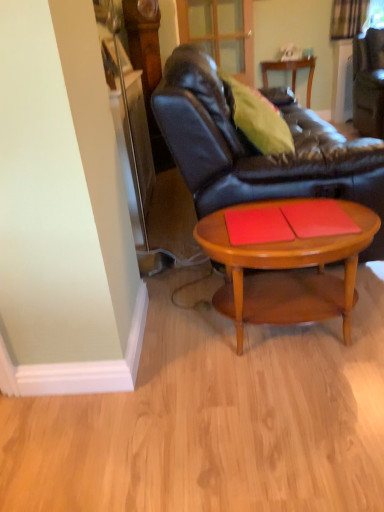
Question: Is red matte placemat at center, the second plank viewed from the left, positioned beyond the bounds of leather couch at center?

Choices:
 (A) yes
 (B) no

Answer: (A)

Question: Is red matte placemat at center, the first plank from the right, wider than leather couch at center?

Choices:
 (A) no
 (B) yes

Answer: (A)

Question: Is red matte placemat at center, the second plank viewed from the left, turned away from leather couch at center?

Choices:
 (A) yes
 (B) no

Answer: (A)

Question: Is red matte placemat at center, the second plank viewed from the left, surrounding leather couch at center?

Choices:
 (A) yes
 (B) no

Answer: (B)

Question: From the image's perspective, does red matte placemat at center, the second plank viewed from the left, appear higher than leather couch at center?

Choices:
 (A) yes
 (B) no

Answer: (B)

Question: Looking at their shapes, would you say light brown wood coffee table at center is wider or thinner than red matte book at center, which ranks as the 2th plank in right-to-left order?

Choices:
 (A) thin
 (B) wide

Answer: (B)

Question: Considering the positions of light brown wood coffee table at center and red matte book at center, the first plank when ordered from left to right, in the image, is light brown wood coffee table at center taller or shorter than red matte book at center, the first plank when ordered from left to right,?

Choices:
 (A) tall
 (B) short

Answer: (A)

Question: Is light brown wood coffee table at center spatially inside red matte book at center, which ranks as the 2th plank in right-to-left order, or outside of it?

Choices:
 (A) outside
 (B) inside

Answer: (A)

Question: Considering the positions of light brown wood coffee table at center and red matte book at center, which ranks as the 2th plank in right-to-left order, in the image, is light brown wood coffee table at center bigger or smaller than red matte book at center, which ranks as the 2th plank in right-to-left order,?

Choices:
 (A) big
 (B) small

Answer: (A)

Question: Based on their positions, is red matte book at center, which ranks as the 2th plank in right-to-left order, located to the left or right of light brown wood coffee table at center?

Choices:
 (A) left
 (B) right

Answer: (A)

Question: Considering the positions of red matte book at center, which ranks as the 2th plank in right-to-left order, and light brown wood coffee table at center in the image, is red matte book at center, which ranks as the 2th plank in right-to-left order, bigger or smaller than light brown wood coffee table at center?

Choices:
 (A) small
 (B) big

Answer: (A)

Question: Would you say red matte book at center, the first plank when ordered from left to right, is inside or outside light brown wood coffee table at center?

Choices:
 (A) outside
 (B) inside

Answer: (A)

Question: Considering the positions of red matte book at center, the first plank when ordered from left to right, and light brown wood coffee table at center in the image, is red matte book at center, the first plank when ordered from left to right, wider or thinner than light brown wood coffee table at center?

Choices:
 (A) wide
 (B) thin

Answer: (B)

Question: Considering the positions of leather couch at center and red matte placemat at center, the first plank from the right, in the image, is leather couch at center wider or thinner than red matte placemat at center, the first plank from the right,?

Choices:
 (A) wide
 (B) thin

Answer: (A)

Question: In terms of height, does leather couch at center look taller or shorter compared to red matte placemat at center, the second plank viewed from the left?

Choices:
 (A) short
 (B) tall

Answer: (B)